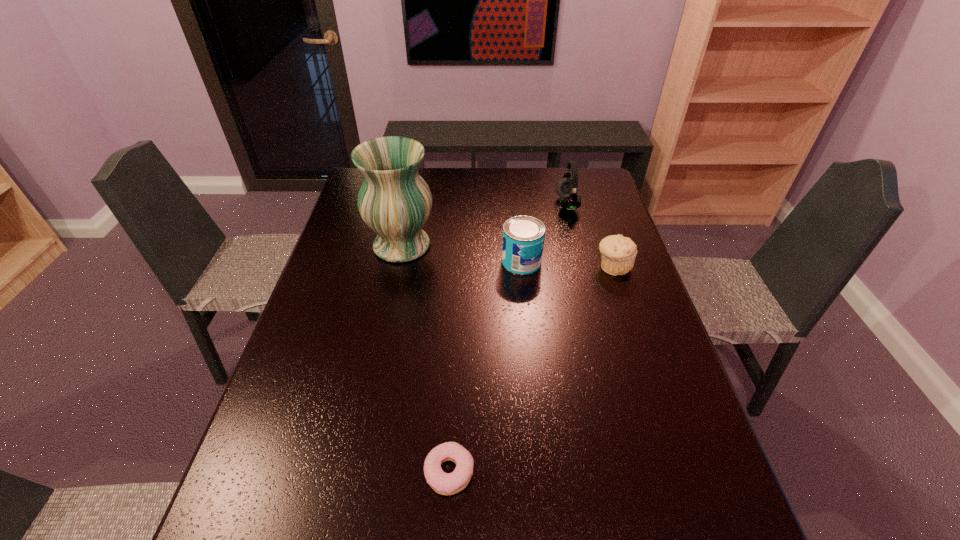
Where is `vacant area between the second object from left to right and the vase`? vacant area between the second object from left to right and the vase is located at coordinates (425, 359).

The height and width of the screenshot is (540, 960). Find the location of `free space that is in between the third tallest object and the second object from left to right`. free space that is in between the third tallest object and the second object from left to right is located at coordinates (486, 367).

Image resolution: width=960 pixels, height=540 pixels. I want to click on unoccupied area between the vase and the third object from left to right, so click(x=462, y=253).

Find the location of a particular element. The width and height of the screenshot is (960, 540). the third closest object to the nearest object is located at coordinates (618, 253).

Where is `object that is the third closest to the tallest object`? object that is the third closest to the tallest object is located at coordinates (618, 253).

Locate an element on the screen. This screenshot has height=540, width=960. free spot that satisfies the following two spatial constraints: 1. on the front side of the muffin; 2. on the right side of the tallest object is located at coordinates (397, 266).

What are the coordinates of `free space that satisfies the following two spatial constraints: 1. on the back side of the third shortest object; 2. on the right side of the fourth object from right to left` in the screenshot? It's located at [x=460, y=261].

Where is `blank area in the image that satisfies the following two spatial constraints: 1. on the ear cups of the second tallest object; 2. on the back side of the muffin`? blank area in the image that satisfies the following two spatial constraints: 1. on the ear cups of the second tallest object; 2. on the back side of the muffin is located at coordinates (584, 266).